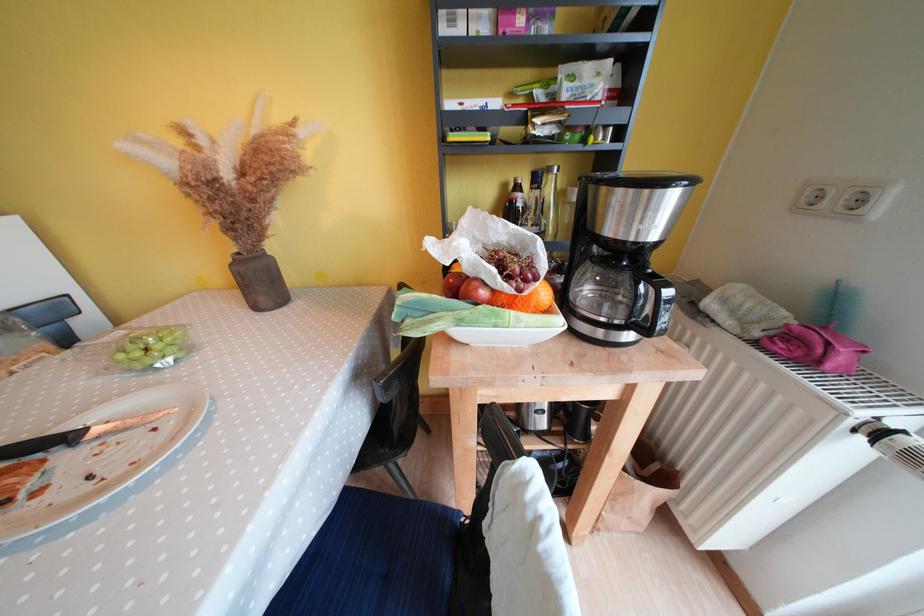
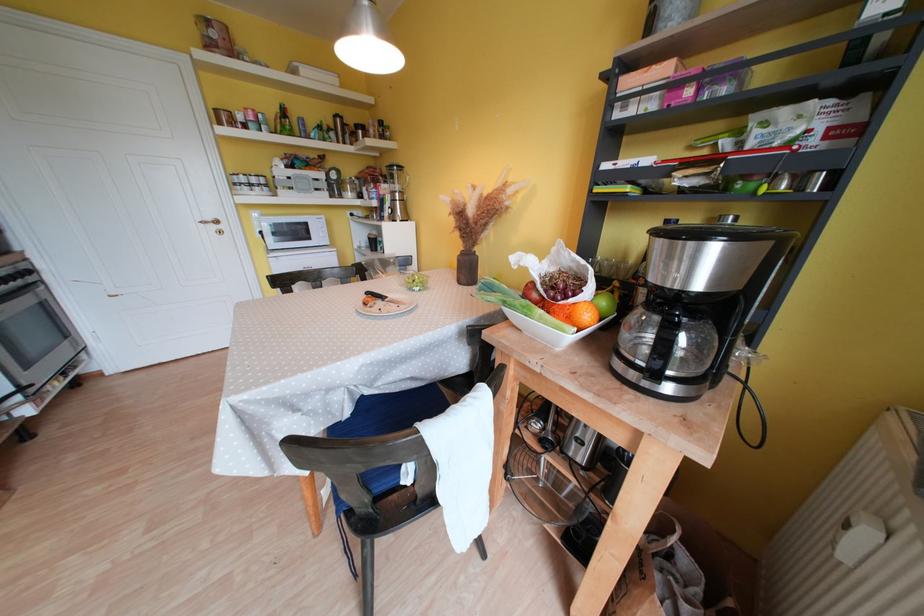
Locate, in the second image, the point that corresponds to point (269, 290) in the first image.

(472, 275)